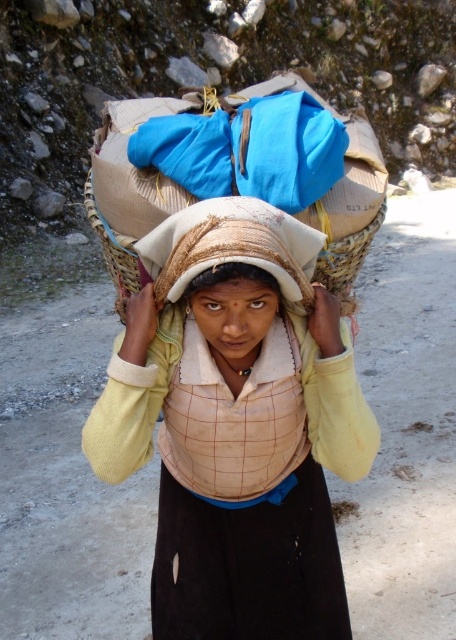
Question: Which point appears closest to the camera in this image?

Choices:
 (A) (322, 269)
 (B) (200, 394)

Answer: (B)

Question: Is light beige woven cloth at center closer to camera compared to woven straw basket at center?

Choices:
 (A) yes
 (B) no

Answer: (A)

Question: Is light beige fabric at center wider than woven straw basket at center?

Choices:
 (A) no
 (B) yes

Answer: (B)

Question: Which of these objects is positioned closest to the light beige fabric at center?

Choices:
 (A) woven straw basket at center
 (B) light beige woven cloth at center

Answer: (B)

Question: Which point appears closest to the camera in this image?

Choices:
 (A) (260, 291)
 (B) (310, 404)

Answer: (A)

Question: Can you confirm if light beige woven cloth at center is thinner than woven straw basket at center?

Choices:
 (A) yes
 (B) no

Answer: (B)